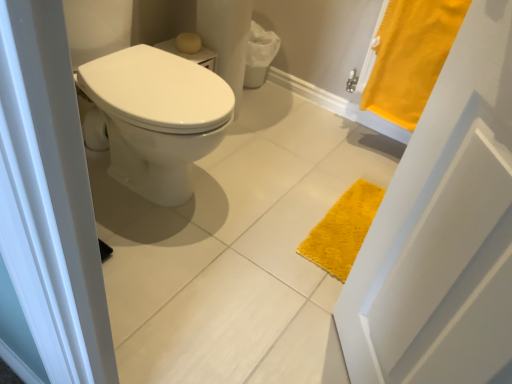
Question: Are matte yellow soap at upper center and yellow fabric bath towel at upper right far apart?

Choices:
 (A) no
 (B) yes

Answer: (A)

Question: Is yellow fabric bath towel at upper right inside matte yellow soap at upper center?

Choices:
 (A) yes
 (B) no

Answer: (B)

Question: Is matte yellow soap at upper center at the right side of yellow fabric bath towel at upper right?

Choices:
 (A) yes
 (B) no

Answer: (B)

Question: Can you confirm if matte yellow soap at upper center is bigger than yellow fabric bath towel at upper right?

Choices:
 (A) yes
 (B) no

Answer: (B)

Question: From a real-world perspective, is matte yellow soap at upper center below yellow fabric bath towel at upper right?

Choices:
 (A) yes
 (B) no

Answer: (A)

Question: From a real-world perspective, is matte yellow soap at upper center positioned over yellow fabric bath towel at upper right based on gravity?

Choices:
 (A) no
 (B) yes

Answer: (A)

Question: Is yellow fabric bath towel at upper right positioned with its back to matte yellow soap at upper center?

Choices:
 (A) yes
 (B) no

Answer: (B)

Question: Considering the relative sizes of yellow fabric bath towel at upper right and matte yellow soap at upper center in the image provided, is yellow fabric bath towel at upper right taller than matte yellow soap at upper center?

Choices:
 (A) yes
 (B) no

Answer: (A)

Question: From the image's perspective, does yellow fabric bath towel at upper right appear lower than matte yellow soap at upper center?

Choices:
 (A) no
 (B) yes

Answer: (B)

Question: Can you confirm if yellow fabric bath towel at upper right is shorter than matte yellow soap at upper center?

Choices:
 (A) no
 (B) yes

Answer: (A)

Question: Are yellow fabric bath towel at upper right and matte yellow soap at upper center beside each other?

Choices:
 (A) no
 (B) yes

Answer: (A)

Question: Is matte yellow soap at upper center completely or partially inside yellow fabric bath towel at upper right?

Choices:
 (A) yes
 (B) no

Answer: (B)

Question: From a real-world perspective, is matte yellow soap at upper center physically located above or below yellow fabric bath towel at upper right?

Choices:
 (A) below
 (B) above

Answer: (A)